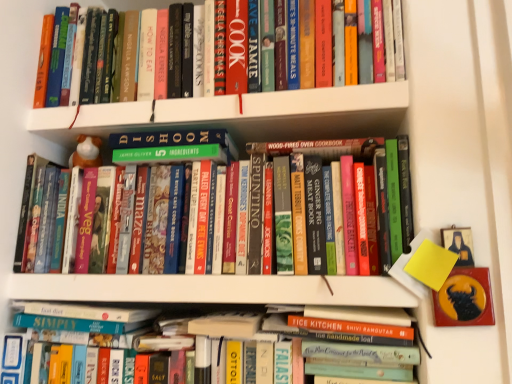
The image size is (512, 384). What do you see at coordinates (250, 105) in the screenshot?
I see `white glossy bookshelf at upper center` at bounding box center [250, 105].

Where is `hardcover books at upper center, the first book in the top-to-bottom sequence`? Image resolution: width=512 pixels, height=384 pixels. hardcover books at upper center, the first book in the top-to-bottom sequence is located at coordinates pos(146,56).

In order to click on hardcover books at center, the 2th book positioned from the bottom in this screenshot , I will do `click(321, 148)`.

Is hardcover book at lower center, which is counted as the first book, starting from the bottom, positioned with its back to hardcover books at center, which is the second book from top to bottom?

That's not correct — hardcover book at lower center, which is counted as the first book, starting from the bottom, is not looking away from hardcover books at center, which is the second book from top to bottom.

In terms of height, does hardcover book at lower center, which is counted as the first book, starting from the bottom, look taller or shorter compared to hardcover books at center, which is the second book from top to bottom?

In the image, hardcover book at lower center, which is counted as the first book, starting from the bottom, appears to be shorter than hardcover books at center, which is the second book from top to bottom.

Which point is more distant from viewer, (341, 376) or (329, 152)?

Positioned behind is point (329, 152).

Consider the image. Which of these two, hardcover book at lower center, which is counted as the first book, starting from the bottom, or hardcover books at center, which is the second book from top to bottom, is smaller?

hardcover book at lower center, which is counted as the first book, starting from the bottom.

Can you confirm if hardcover books at center, the 2th book positioned from the bottom, is wider than white glossy bookshelf at upper center?

No.

Is hardcover books at center, the 2th book positioned from the bottom, located outside white glossy bookshelf at upper center?

Yes, hardcover books at center, the 2th book positioned from the bottom, is not within white glossy bookshelf at upper center.

Is hardcover books at center, which is the second book from top to bottom, bigger than white glossy bookshelf at upper center?

Indeed, hardcover books at center, which is the second book from top to bottom, has a larger size compared to white glossy bookshelf at upper center.

How different are the orientations of hardcover books at center, which is the second book from top to bottom, and white glossy bookshelf at upper center in degrees?

The angular difference between hardcover books at center, which is the second book from top to bottom, and white glossy bookshelf at upper center is 0.322 degrees.

Is hardcover book at lower center, which is counted as the first book, starting from the bottom, thinner than white glossy bookshelf at upper center?

Indeed, hardcover book at lower center, which is counted as the first book, starting from the bottom, has a lesser width compared to white glossy bookshelf at upper center.

Where is `shelf above the hardcover book at lower center, positioned as the third book in top-to-bottom order (from the image's perspective)`? The height and width of the screenshot is (384, 512). shelf above the hardcover book at lower center, positioned as the third book in top-to-bottom order (from the image's perspective) is located at coordinates (250, 105).

From the image's perspective, is hardcover book at lower center, which is counted as the first book, starting from the bottom, above white glossy bookshelf at upper center?

Actually, hardcover book at lower center, which is counted as the first book, starting from the bottom, appears below white glossy bookshelf at upper center in the image.

From the picture: Considering the positions of objects hardcover book at lower center, positioned as the third book in top-to-bottom order, and white glossy bookshelf at upper center in the image provided, who is more to the right, hardcover book at lower center, positioned as the third book in top-to-bottom order, or white glossy bookshelf at upper center?

white glossy bookshelf at upper center.

The height and width of the screenshot is (384, 512). Identify the location of the 1st book below when counting from the hardcover books at upper center, the first book in the top-to-bottom sequence (from the image's perspective). (321, 148).

Is hardcover books at center, the 2th book positioned from the bottom, placed right next to hardcover books at upper center, the first book in the top-to-bottom sequence?

No, hardcover books at center, the 2th book positioned from the bottom, is not with hardcover books at upper center, the first book in the top-to-bottom sequence.

Can hardcover books at upper center, the first book in the top-to-bottom sequence, be found inside hardcover books at center, the 2th book positioned from the bottom?

No, hardcover books at upper center, the first book in the top-to-bottom sequence, is not surrounded by hardcover books at center, the 2th book positioned from the bottom.

Which point is more forward, (346, 152) or (85, 19)?

Point (346, 152)

Is hardcover books at upper center, which appears as the third book when ordered from the bottom, in contact with hardcover books at center, which is the second book from top to bottom?

hardcover books at upper center, which appears as the third book when ordered from the bottom, and hardcover books at center, which is the second book from top to bottom, are clearly separated.

Is hardcover books at upper center, the first book in the top-to-bottom sequence, oriented towards hardcover books at center, the 2th book positioned from the bottom?

No, hardcover books at upper center, the first book in the top-to-bottom sequence, does not turn towards hardcover books at center, the 2th book positioned from the bottom.

Locate an element on the screen. The image size is (512, 384). book above the hardcover books at center, the 2th book positioned from the bottom (from the image's perspective) is located at coordinates (146, 56).

Is hardcover book at lower center, which is counted as the first book, starting from the bottom, completely or partially inside white glossy bookshelf at upper center?

No, hardcover book at lower center, which is counted as the first book, starting from the bottom, is not a part of white glossy bookshelf at upper center.

This screenshot has width=512, height=384. Find the location of `shelf that is above the hardcover book at lower center, positioned as the third book in top-to-bottom order (from a real-world perspective)`. shelf that is above the hardcover book at lower center, positioned as the third book in top-to-bottom order (from a real-world perspective) is located at coordinates (250, 105).

Is white glossy bookshelf at upper center oriented towards hardcover book at lower center, which is counted as the first book, starting from the bottom?

No, white glossy bookshelf at upper center does not turn towards hardcover book at lower center, which is counted as the first book, starting from the bottom.

Which object is more forward, white glossy bookshelf at upper center or hardcover book at lower center, which is counted as the first book, starting from the bottom?

Positioned in front is hardcover book at lower center, which is counted as the first book, starting from the bottom.

Who is bigger, hardcover books at upper center, the first book in the top-to-bottom sequence, or hardcover book at lower center, which is counted as the first book, starting from the bottom?

hardcover books at upper center, the first book in the top-to-bottom sequence, is bigger.

Does hardcover books at upper center, the first book in the top-to-bottom sequence, come behind hardcover book at lower center, positioned as the third book in top-to-bottom order?

Yes, the depth of hardcover books at upper center, the first book in the top-to-bottom sequence, is greater than that of hardcover book at lower center, positioned as the third book in top-to-bottom order.

Is hardcover books at upper center, the first book in the top-to-bottom sequence, placed right next to hardcover book at lower center, positioned as the third book in top-to-bottom order?

hardcover books at upper center, the first book in the top-to-bottom sequence, and hardcover book at lower center, positioned as the third book in top-to-bottom order, are not in contact.

Would you say hardcover books at upper center, which appears as the third book when ordered from the bottom, contains hardcover book at lower center, positioned as the third book in top-to-bottom order?

No, hardcover books at upper center, which appears as the third book when ordered from the bottom, does not contain hardcover book at lower center, positioned as the third book in top-to-bottom order.

Starting from the hardcover book at lower center, which is counted as the first book, starting from the bottom, which book is the 1st one behind? Please provide its 2D coordinates.

[(321, 148)]

There is a white glossy bookshelf at upper center. Where is `the 1st book below it (from the image's perspective)`? The width and height of the screenshot is (512, 384). the 1st book below it (from the image's perspective) is located at coordinates (321, 148).

Considering their positions, is hardcover books at upper center, which appears as the third book when ordered from the bottom, positioned closer to white glossy bookshelf at upper center than hardcover books at center, which is the second book from top to bottom?

Based on the image, hardcover books at upper center, which appears as the third book when ordered from the bottom, appears to be nearer to white glossy bookshelf at upper center.

From the image, which object appears to be nearer to hardcover books at upper center, the first book in the top-to-bottom sequence, hardcover books at center, the 2th book positioned from the bottom, or white glossy bookshelf at upper center?

Among the two, white glossy bookshelf at upper center is located nearer to hardcover books at upper center, the first book in the top-to-bottom sequence.

Which object lies nearer to the anchor point white glossy bookshelf at upper center, hardcover book at lower center, positioned as the third book in top-to-bottom order, or hardcover books at center, which is the second book from top to bottom?

hardcover books at center, which is the second book from top to bottom, is positioned closer to the anchor white glossy bookshelf at upper center.

Looking at this image, considering their positions, is white glossy bookshelf at upper center positioned closer to hardcover book at lower center, positioned as the third book in top-to-bottom order, than hardcover books at upper center, which appears as the third book when ordered from the bottom?

Based on the image, white glossy bookshelf at upper center appears to be nearer to hardcover book at lower center, positioned as the third book in top-to-bottom order.

From the image, which object appears to be nearer to white glossy bookshelf at upper center, hardcover book at lower center, which is counted as the first book, starting from the bottom, or hardcover books at upper center, the first book in the top-to-bottom sequence?

Based on the image, hardcover books at upper center, the first book in the top-to-bottom sequence, appears to be nearer to white glossy bookshelf at upper center.

Estimate the real-world distances between objects in this image. Which object is closer to white glossy bookshelf at upper center, hardcover books at center, the 2th book positioned from the bottom, or hardcover books at upper center, which appears as the third book when ordered from the bottom?

The object closer to white glossy bookshelf at upper center is hardcover books at upper center, which appears as the third book when ordered from the bottom.

Which object lies further to the anchor point hardcover books at upper center, the first book in the top-to-bottom sequence, hardcover book at lower center, positioned as the third book in top-to-bottom order, or hardcover books at center, the 2th book positioned from the bottom?

Among the two, hardcover book at lower center, positioned as the third book in top-to-bottom order, is located further to hardcover books at upper center, the first book in the top-to-bottom sequence.

Estimate the real-world distances between objects in this image. Which object is further from hardcover books at center, the 2th book positioned from the bottom, white glossy bookshelf at upper center or hardcover books at upper center, which appears as the third book when ordered from the bottom?

Among the two, hardcover books at upper center, which appears as the third book when ordered from the bottom, is located further to hardcover books at center, the 2th book positioned from the bottom.

Locate an element on the screen. book between hardcover books at upper center, the first book in the top-to-bottom sequence, and hardcover book at lower center, which is counted as the first book, starting from the bottom, in the vertical direction is located at coordinates (321, 148).

I want to click on shelf between hardcover books at upper center, which appears as the third book when ordered from the bottom, and hardcover books at center, which is the second book from top to bottom, from top to bottom, so click(x=250, y=105).

The height and width of the screenshot is (384, 512). Identify the location of shelf between hardcover books at upper center, the first book in the top-to-bottom sequence, and hardcover book at lower center, positioned as the third book in top-to-bottom order, in the vertical direction. (250, 105).

You are a GUI agent. You are given a task and a screenshot of the screen. Output one action in this format:
    pyautogui.click(x=<x>, y=<y>)
    Task: Click on the book between white glossy bookshelf at upper center and hardcover book at lower center, positioned as the third book in top-to-bottom order, from top to bottom
    
    Given the screenshot: What is the action you would take?
    pyautogui.click(x=321, y=148)